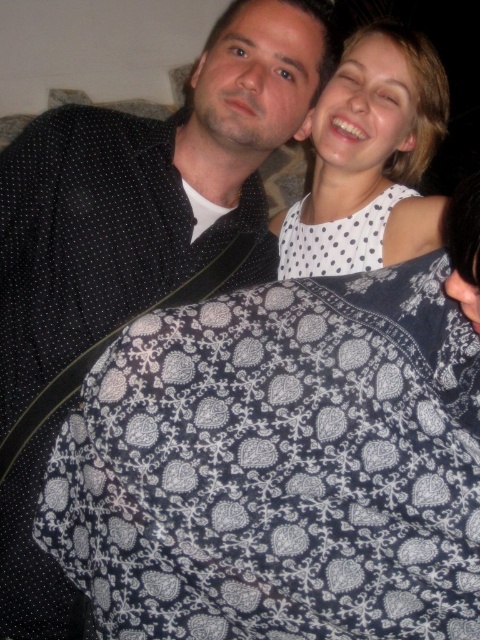
Is point (130, 289) positioned before point (348, 216)?

Yes, point (130, 289) is in front of point (348, 216).

Does black dotted shirt at upper left have a larger size compared to white dotted dress at upper right?

Yes.

Image resolution: width=480 pixels, height=640 pixels. I want to click on black dotted shirt at upper left, so click(132, 248).

Can you confirm if dark blue fabric at center is shorter than black dotted shirt at upper left?

Yes, dark blue fabric at center is shorter than black dotted shirt at upper left.

The width and height of the screenshot is (480, 640). What are the coordinates of `dark blue fabric at center` in the screenshot? It's located at (278, 467).

Looking at this image, can you confirm if dark blue fabric at center is positioned to the right of white dotted dress at upper right?

In fact, dark blue fabric at center is to the left of white dotted dress at upper right.

Which is above, dark blue fabric at center or white dotted dress at upper right?

Positioned higher is white dotted dress at upper right.

Locate an element on the screen. Image resolution: width=480 pixels, height=640 pixels. dark blue fabric at center is located at coordinates (278, 467).